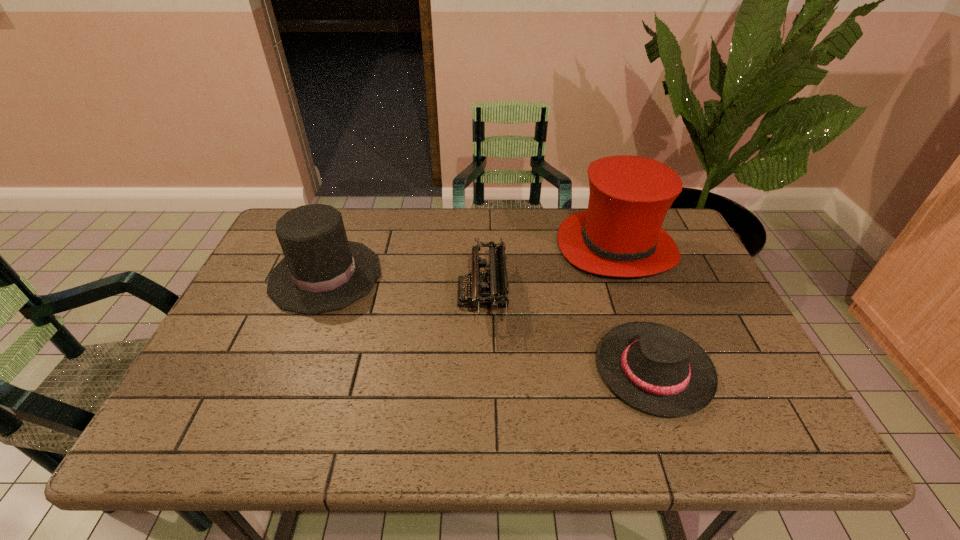
Locate an element on the screen. This screenshot has height=540, width=960. the tallest dress hat is located at coordinates (620, 235).

The image size is (960, 540). I want to click on the second tallest dress hat, so click(322, 271).

Find the location of a particular element. The width and height of the screenshot is (960, 540). the second tallest object is located at coordinates (322, 271).

This screenshot has width=960, height=540. Identify the location of the third object from right to left. (488, 288).

Find the location of a particular element. the shortest dress hat is located at coordinates (657, 369).

Locate an element on the screen. The image size is (960, 540). free space located 0.330m on the front of the tallest object is located at coordinates (667, 386).

Where is `blank space located 0.270m on the front of the leftmost dress hat with the decoration`? blank space located 0.270m on the front of the leftmost dress hat with the decoration is located at coordinates (477, 275).

You are a GUI agent. You are given a task and a screenshot of the screen. Output one action in this format:
    pyautogui.click(x=<x>, y=<y>)
    Task: Click on the vacant space located on the typing side of the typewriter
    The image size is (960, 540).
    Given the screenshot: What is the action you would take?
    pyautogui.click(x=313, y=294)

Where is `free space located 0.330m on the typing side of the typewriter`? The image size is (960, 540). free space located 0.330m on the typing side of the typewriter is located at coordinates (335, 294).

This screenshot has width=960, height=540. What are the coordinates of `free space located on the typing side of the typewriter` in the screenshot? It's located at (347, 294).